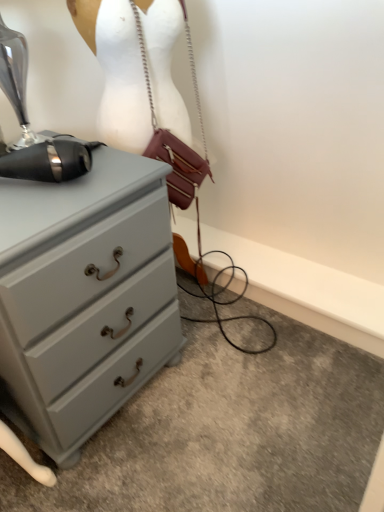
Question: Is white matte mannequin at upper center bigger than leather/metallic handbag at center?

Choices:
 (A) yes
 (B) no

Answer: (A)

Question: Is white matte mannequin at upper center closer to camera compared to leather/metallic handbag at center?

Choices:
 (A) yes
 (B) no

Answer: (B)

Question: Considering the relative sizes of white matte mannequin at upper center and leather/metallic handbag at center in the image provided, is white matte mannequin at upper center wider than leather/metallic handbag at center?

Choices:
 (A) yes
 (B) no

Answer: (A)

Question: From the image's perspective, is white matte mannequin at upper center on leather/metallic handbag at center?

Choices:
 (A) yes
 (B) no

Answer: (B)

Question: Does white matte mannequin at upper center come behind leather/metallic handbag at center?

Choices:
 (A) no
 (B) yes

Answer: (B)

Question: Is leather/metallic handbag at center completely or partially inside white matte mannequin at upper center?

Choices:
 (A) yes
 (B) no

Answer: (A)

Question: Is black metallic sewing machine at upper left at the right side of leather/metallic handbag at center?

Choices:
 (A) yes
 (B) no

Answer: (B)

Question: Is black metallic sewing machine at upper left positioned in front of leather/metallic handbag at center?

Choices:
 (A) yes
 (B) no

Answer: (A)

Question: Can you confirm if black metallic sewing machine at upper left is smaller than leather/metallic handbag at center?

Choices:
 (A) yes
 (B) no

Answer: (B)

Question: Can you confirm if black metallic sewing machine at upper left is thinner than leather/metallic handbag at center?

Choices:
 (A) no
 (B) yes

Answer: (A)

Question: From a real-world perspective, does black metallic sewing machine at upper left sit lower than leather/metallic handbag at center?

Choices:
 (A) yes
 (B) no

Answer: (B)

Question: From a real-world perspective, is black metallic sewing machine at upper left positioned over leather/metallic handbag at center based on gravity?

Choices:
 (A) yes
 (B) no

Answer: (A)

Question: Can we say leather/metallic handbag at center lies outside white matte mannequin at upper center?

Choices:
 (A) no
 (B) yes

Answer: (A)